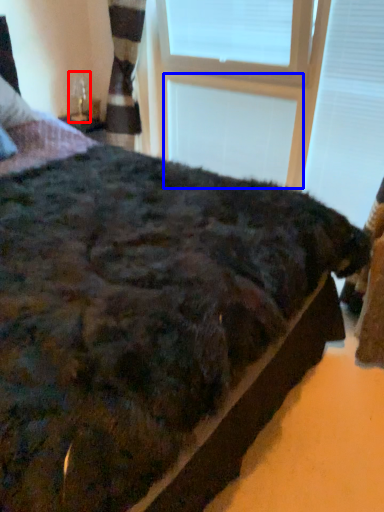
Question: Which object is further to the camera taking this photo, table lamp (highlighted by a red box) or window frame (highlighted by a blue box)?

Choices:
 (A) table lamp
 (B) window frame

Answer: (A)